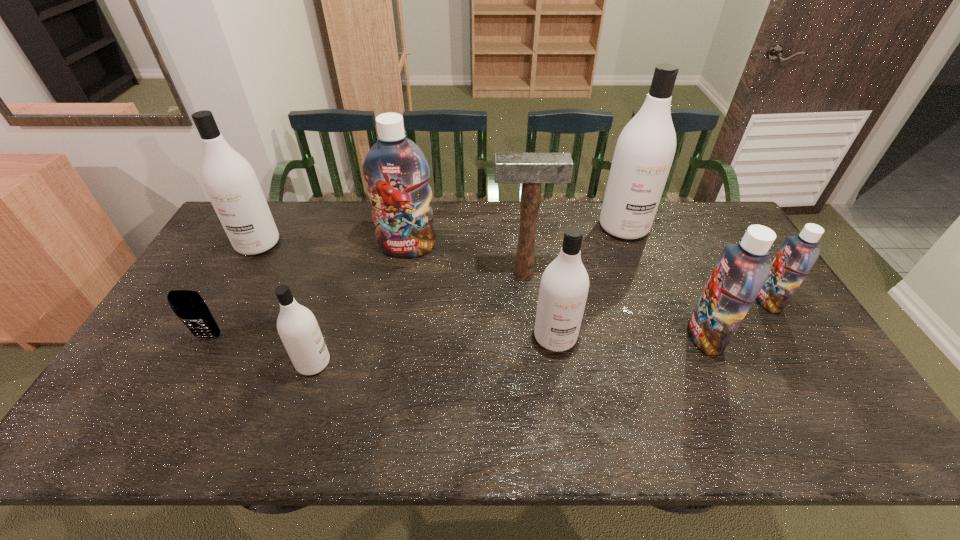
You are a GUI agent. You are given a task and a screenshot of the screen. Output one action in this format:
    pyautogui.click(x=<x>, y=<y>)
    Task: Click on the vacant region located 0.190m on the front label of the second smallest blue shampoo
    
    Given the screenshot: What is the action you would take?
    pyautogui.click(x=619, y=336)

The height and width of the screenshot is (540, 960). I want to click on free space located on the front label of the second smallest blue shampoo, so click(x=663, y=336).

Identify the location of free space located 0.240m on the front-facing side of the fourth shampoo from right to left. (571, 443).

What are the coordinates of `vacant space situated 0.150m on the front label of the smallest blue shampoo` in the screenshot? It's located at (706, 301).

Locate an element on the screen. Image resolution: width=960 pixels, height=540 pixels. vacant space located on the front label of the smallest blue shampoo is located at coordinates (655, 301).

Locate an element on the screen. The width and height of the screenshot is (960, 540). free space located 0.400m on the front label of the smallest blue shampoo is located at coordinates (620, 301).

Image resolution: width=960 pixels, height=540 pixels. I want to click on free region located 0.300m on the front-facing side of the smallest white shampoo, so click(x=446, y=363).

This screenshot has height=540, width=960. What are the coordinates of `free region located on the screen of the shortest object` in the screenshot? It's located at (159, 424).

The height and width of the screenshot is (540, 960). In order to click on shampoo that is at the left edge in this screenshot , I will do `click(229, 180)`.

Find the location of `cellular telephone located at the left edge`. cellular telephone located at the left edge is located at coordinates (190, 308).